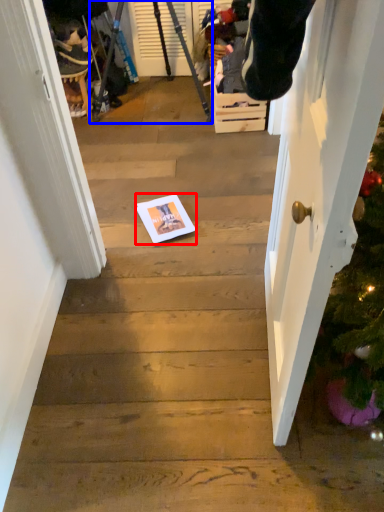
Question: Which of the following is the farthest to the observer, copy (highlighted by a red box) or tripod (highlighted by a blue box)?

Choices:
 (A) copy
 (B) tripod

Answer: (B)